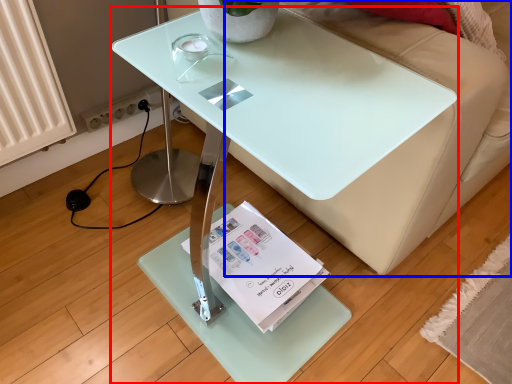
Question: Among these objects, which one is nearest to the camera, table (highlighted by a red box) or couch (highlighted by a blue box)?

Choices:
 (A) table
 (B) couch

Answer: (A)